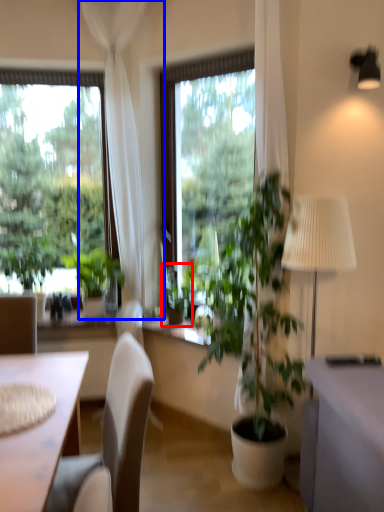
Question: Which object is further to the camera taking this photo, houseplant (highlighted by a red box) or curtain (highlighted by a blue box)?

Choices:
 (A) houseplant
 (B) curtain

Answer: (A)